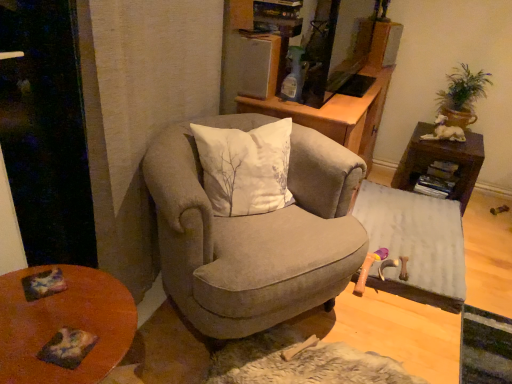
Question: Considering the positions of point (330, 112) and point (465, 94), is point (330, 112) closer or farther from the camera than point (465, 94)?

Choices:
 (A) farther
 (B) closer

Answer: (B)

Question: Looking at their shapes, would you say wooden cabinet at center is wider or thinner than green leafy plant at upper right?

Choices:
 (A) thin
 (B) wide

Answer: (B)

Question: Which object is the farthest from the white fabric ottoman at lower right, marked as the 2th table in a top-to-bottom arrangement?

Choices:
 (A) wooden table at lower left
 (B) suede armchair at center
 (C) green leafy plant at upper right
 (D) brown wooden table at right, which appears as the first table when viewed from the top
 (E) wooden cabinet at center

Answer: (A)

Question: Which object is positioned closest to the green leafy plant at upper right?

Choices:
 (A) wooden table at lower left
 (B) suede armchair at center
 (C) wooden cabinet at center
 (D) brown wooden table at right, which appears as the first table when viewed from the top
 (E) white fabric ottoman at lower right, acting as the first table starting from the bottom

Answer: (D)